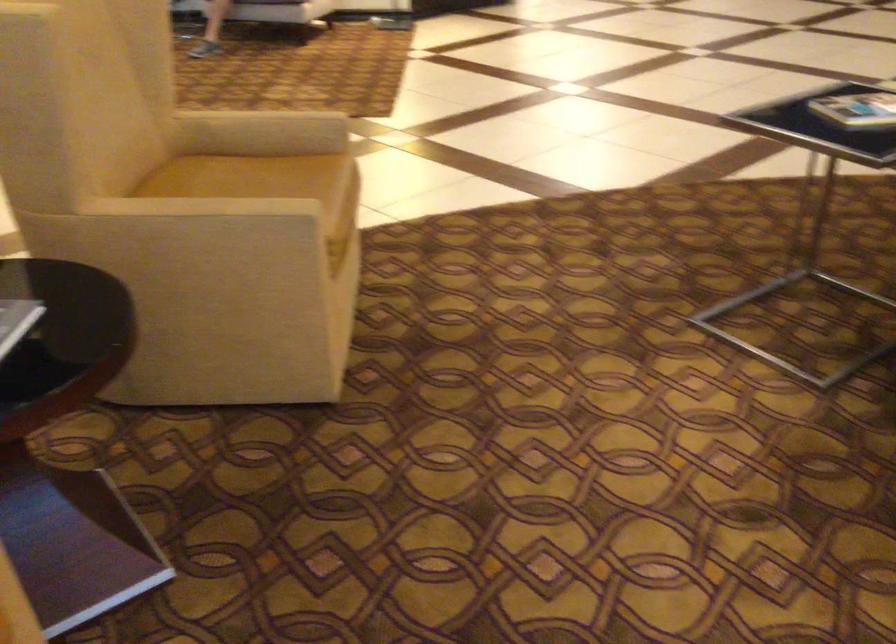
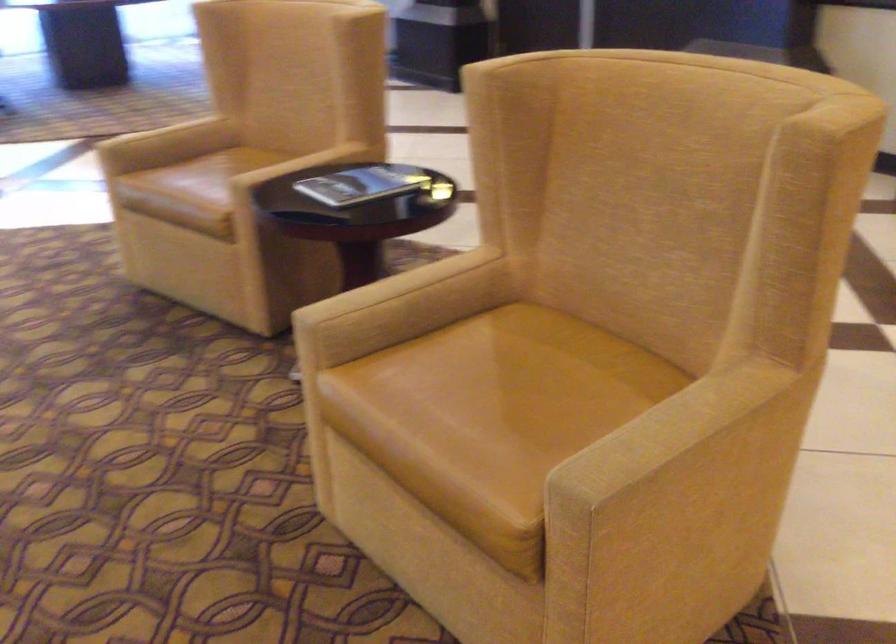
Where in the second image is the point corresponding to pixel 274 120 from the first image?

(707, 433)